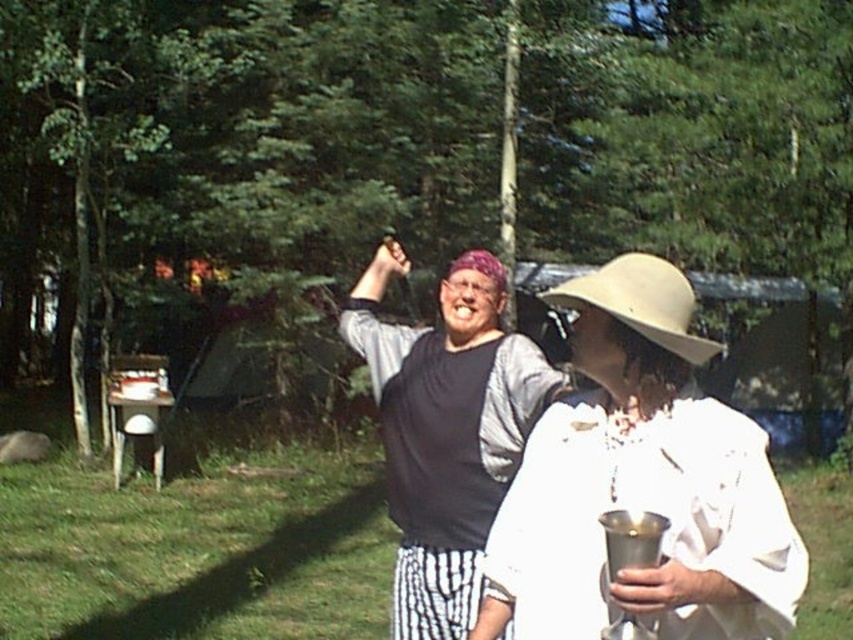
You are a photographer trying to capture a closeup of the white matte hat at center and the matte black shirt at center. Since you want to focus on both objects equally, which one should you zoom in on more to ensure they appear similar in size in the photo?

The white matte hat at center has a lesser width compared to matte black shirt at center, so you should zoom in more on the white matte hat at center to make it appear larger and balance its size with the matte black shirt at center in the photo.

You are a photographer taking a picture of the two hats in the scene. Which hat should you focus on first if you need to capture the white matte hat at center and the beige fabric hat at upper center from left to right?

The white matte hat at center is to the left of beige fabric hat at upper center, so you should focus on the white matte hat at center first when capturing them from left to right.

You are standing in a forest clearing and see a point marked at coordinates (445, 278). If you want to place a 5 meter long bench here, will it fit without overlapping the point?

The point at (445, 278) is 4.63 meters away from the viewer. Since the bench is 5 meters long, it might extend beyond the point, but placement depends on the direction. However, the distance from the viewer to the point is less than the bench length, so part of the bench could overlap the point if placed directly towards it.